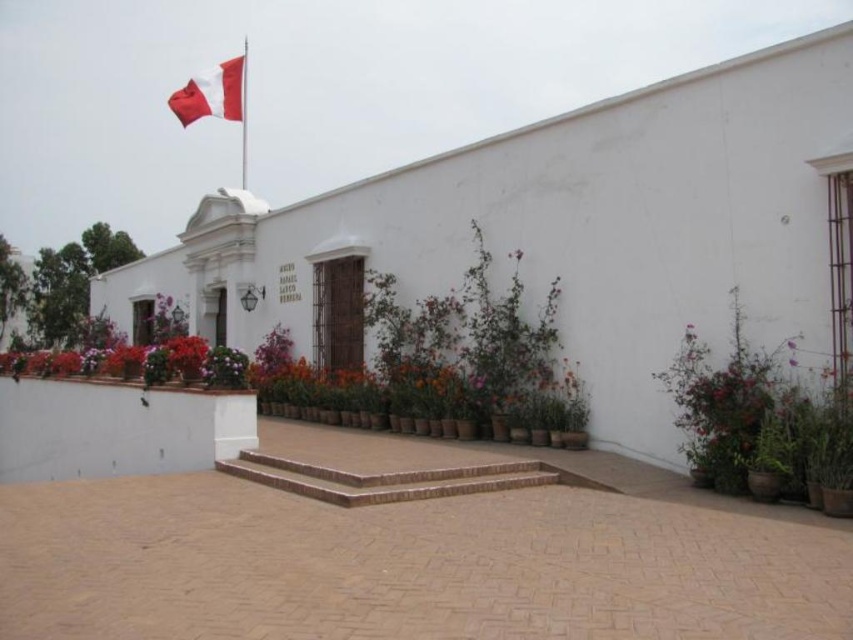
You are a visitor standing in front of the building and want to take a photo that includes both the green leafy plant at right and the metallic flag pole at upper left. Which object should appear smaller in the photo?

The green leafy plant at right should appear smaller in the photo because it is not as tall as the metallic flag pole at upper left.

You are standing in front of the white building with the Peruvian flag. There are two points marked on the ground. One is at coordinate point(694, 381) and the other is at point(247, 74). From your perspective facing the building, which point is closer to the entrance?

Point(694, 381) is in front of point(247, 74), so it is closer to the entrance.